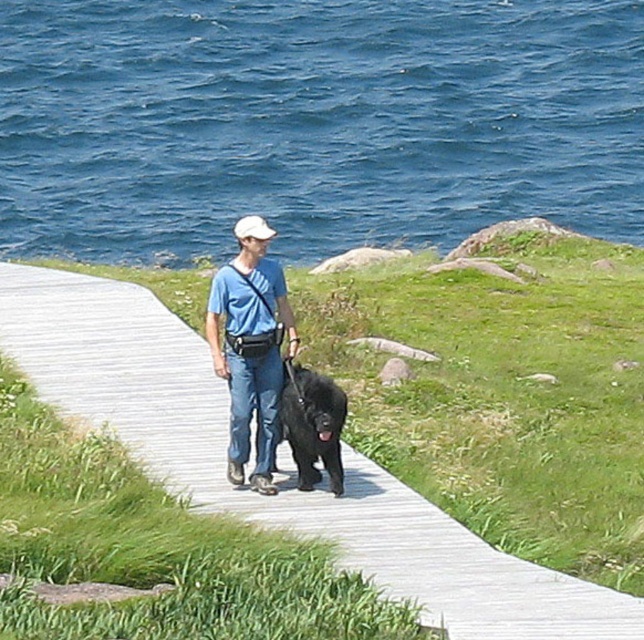
Question: Is blue water at upper center thinner than wooden boardwalk at center?

Choices:
 (A) no
 (B) yes

Answer: (A)

Question: Can you confirm if matte blue shirt at center is positioned to the left of white fabric baseball cap at center?

Choices:
 (A) no
 (B) yes

Answer: (A)

Question: Which point is closer to the camera?

Choices:
 (A) white fabric baseball cap at center
 (B) wooden boardwalk at center
 (C) blue water at upper center
 (D) matte blue shirt at center

Answer: (B)

Question: Which of the following is the closest to the observer?

Choices:
 (A) 272,385
 (B) 419,540
 (C) 603,177

Answer: (B)

Question: Can you confirm if wooden boardwalk at center is positioned below black fluffy dog at center?

Choices:
 (A) no
 (B) yes

Answer: (A)

Question: Which of the following is the farthest from the observer?

Choices:
 (A) white fabric baseball cap at center
 (B) matte blue shirt at center
 (C) blue water at upper center
 (D) wooden boardwalk at center

Answer: (C)